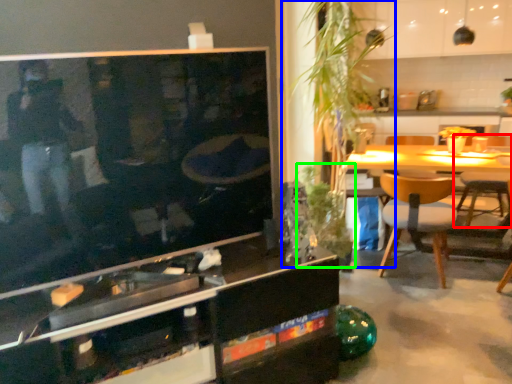
Question: Which is farther away from chair (highlighted by a red box)? plant (highlighted by a blue box) or plant (highlighted by a green box)?

Choices:
 (A) plant
 (B) plant

Answer: (A)